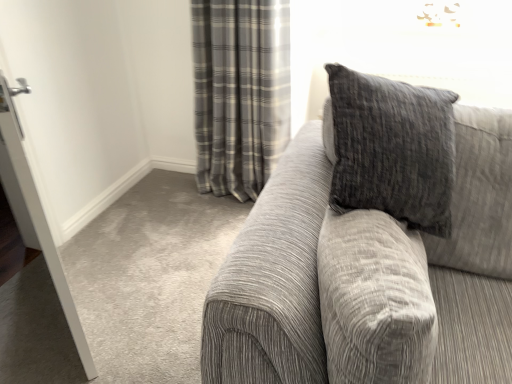
Question: Is gray plaid curtain at upper center located within white glossy door at left?

Choices:
 (A) yes
 (B) no

Answer: (B)

Question: Are white glossy door at left and gray plaid curtain at upper center far apart?

Choices:
 (A) yes
 (B) no

Answer: (A)

Question: Is white glossy door at left with gray plaid curtain at upper center?

Choices:
 (A) yes
 (B) no

Answer: (B)

Question: Is white glossy door at left further to camera compared to gray plaid curtain at upper center?

Choices:
 (A) yes
 (B) no

Answer: (B)

Question: From the image's perspective, is white glossy door at left below gray plaid curtain at upper center?

Choices:
 (A) yes
 (B) no

Answer: (A)

Question: Visually, is textured gray couch at right positioned to the left or to the right of gray plaid curtain at upper center?

Choices:
 (A) left
 (B) right

Answer: (B)

Question: From their relative heights in the image, would you say textured gray couch at right is taller or shorter than gray plaid curtain at upper center?

Choices:
 (A) short
 (B) tall

Answer: (A)

Question: Is textured gray couch at right situated inside gray plaid curtain at upper center or outside?

Choices:
 (A) outside
 (B) inside

Answer: (A)

Question: Looking at their shapes, would you say textured gray couch at right is wider or thinner than gray plaid curtain at upper center?

Choices:
 (A) wide
 (B) thin

Answer: (A)

Question: Considering the positions of white glossy door at left and textured gray couch at right in the image, is white glossy door at left bigger or smaller than textured gray couch at right?

Choices:
 (A) big
 (B) small

Answer: (B)

Question: In the image, is white glossy door at left on the left side or the right side of textured gray couch at right?

Choices:
 (A) right
 (B) left

Answer: (B)

Question: Is white glossy door at left inside or outside of textured gray couch at right?

Choices:
 (A) inside
 (B) outside

Answer: (B)

Question: From a real-world perspective, is white glossy door at left physically located above or below textured gray couch at right?

Choices:
 (A) below
 (B) above

Answer: (B)

Question: Is white glossy door at left in front of or behind gray plaid curtain at upper center in the image?

Choices:
 (A) behind
 (B) front

Answer: (B)

Question: Is white glossy door at left situated inside gray plaid curtain at upper center or outside?

Choices:
 (A) outside
 (B) inside

Answer: (A)